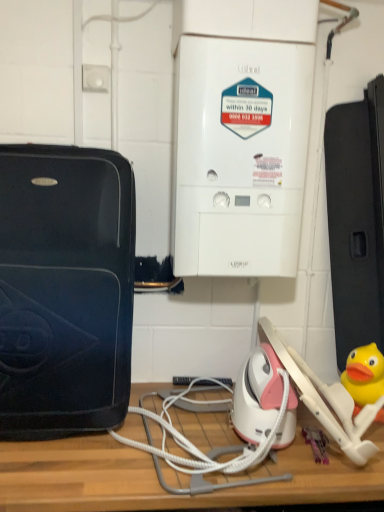
Question: From a real-world perspective, is white cord at center above or below yellow rubber duck at lower right?

Choices:
 (A) below
 (B) above

Answer: (A)

Question: Is white cord at center wider or thinner than yellow rubber duck at lower right?

Choices:
 (A) wide
 (B) thin

Answer: (A)

Question: Which object is positioned closest to the wooden table at center?

Choices:
 (A) white plastic boiler at center, the 1th home appliance in the right-to-left sequence
 (B) yellow rubber duck at lower right
 (C) matte black suitcase at left, marked as the second home appliance in a right-to-left arrangement
 (D) white cord at center

Answer: (D)

Question: Which is farther from the white cord at center?

Choices:
 (A) yellow rubber duck at lower right
 (B) matte black suitcase at left, which is the first home appliance in left-to-right order
 (C) wooden table at center
 (D) white plastic boiler at center, placed as the second home appliance when sorted from left to right

Answer: (D)